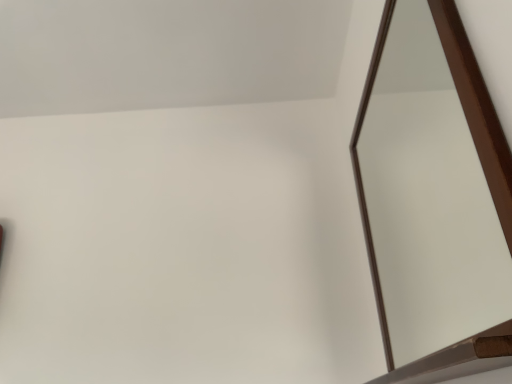
Locate an element on the screen. Image resolution: width=512 pixels, height=384 pixels. brown wooden mirror at right is located at coordinates (432, 185).

Describe the element at coordinates (432, 185) in the screenshot. I see `brown wooden mirror at right` at that location.

I want to click on brown wooden mirror at right, so click(432, 185).